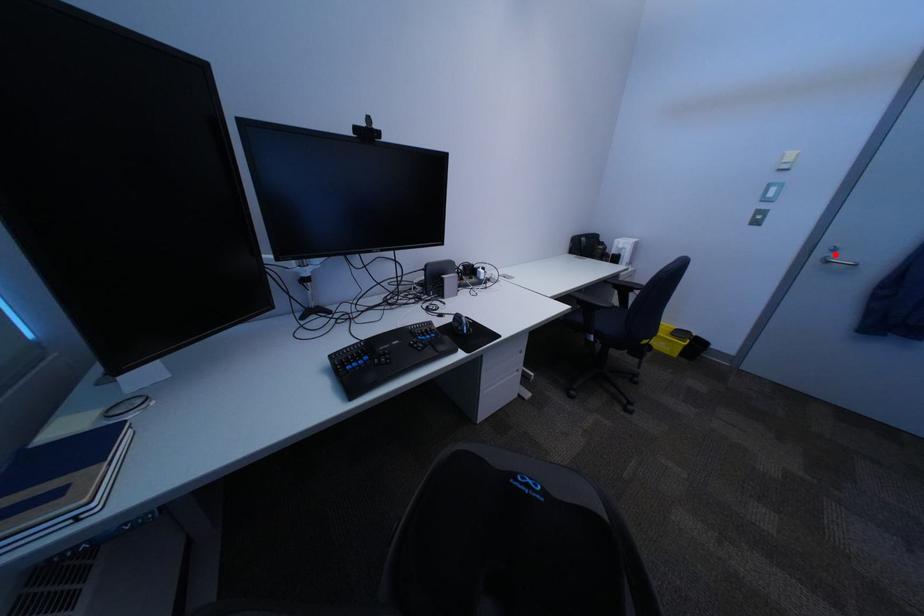
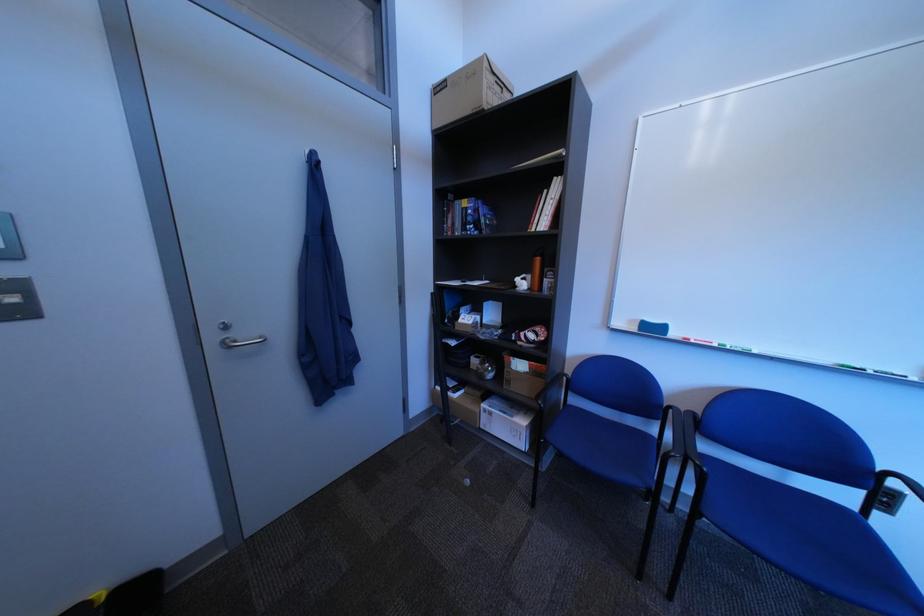
Question: I am providing you with two images of the same scene from different viewpoints. Image1 has a red point marked. In image2, the corresponding 3D location appears at what relative position? Reply with the corresponding letter.

Choices:
 (A) Closer
 (B) Farther

Answer: (A)